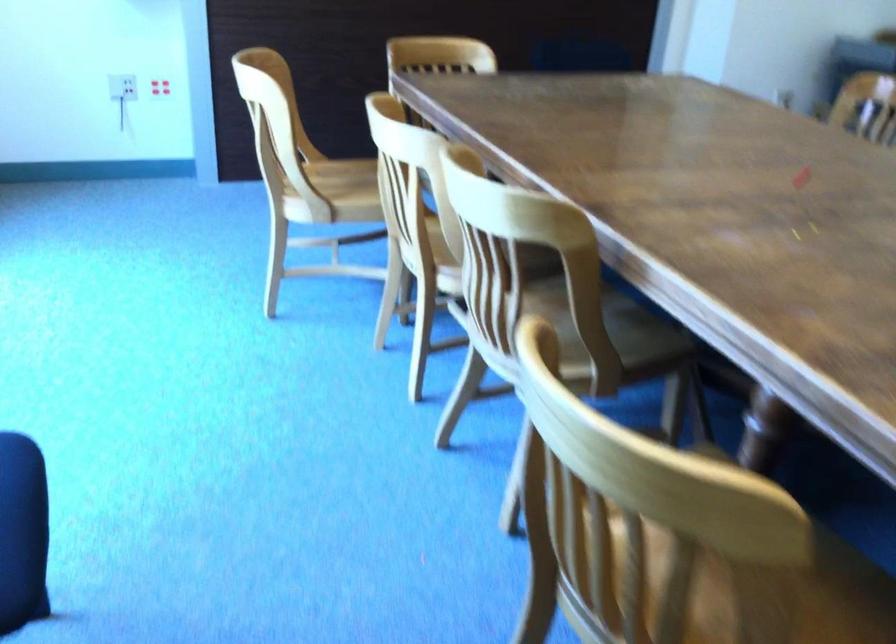
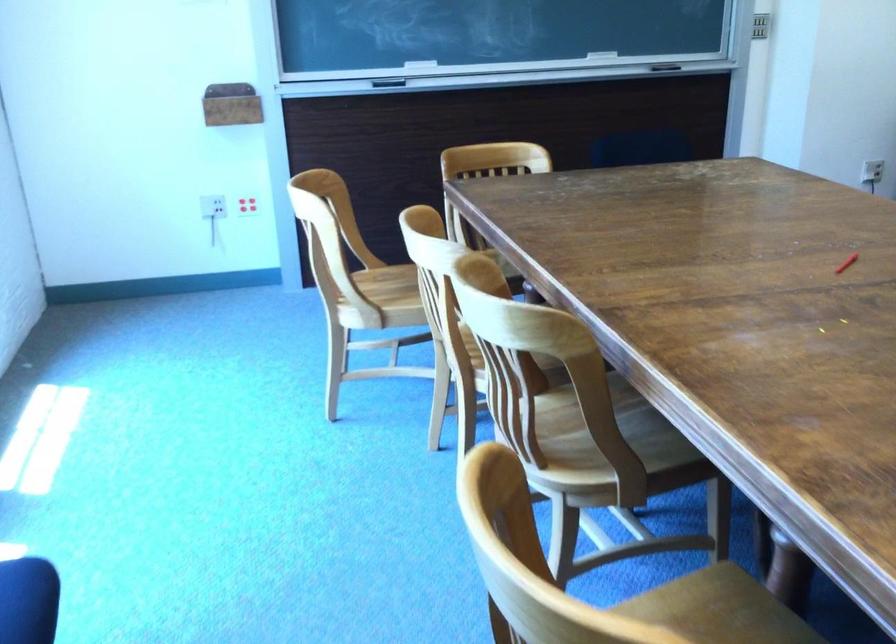
Locate, in the second image, the point that corresponds to point 331,180 in the first image.

(393, 286)